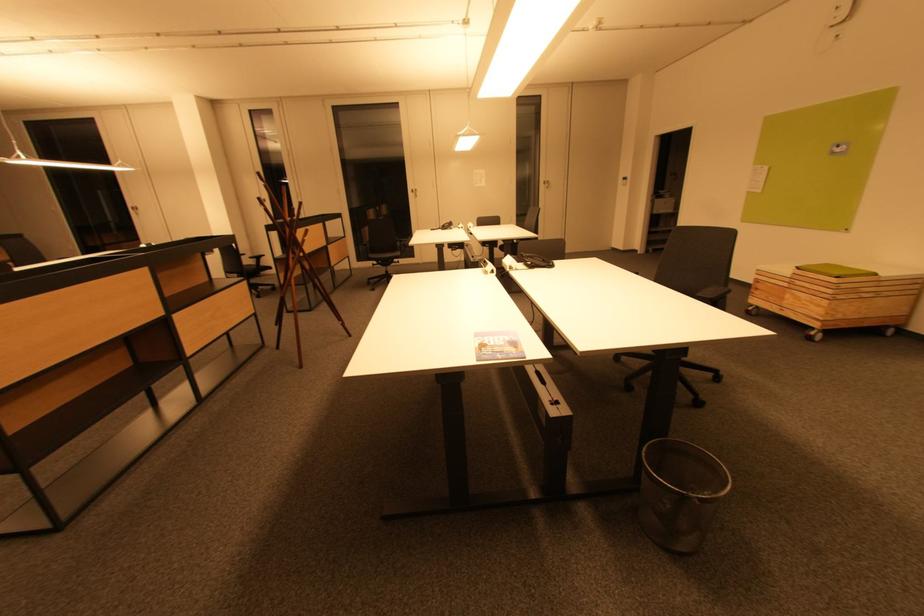
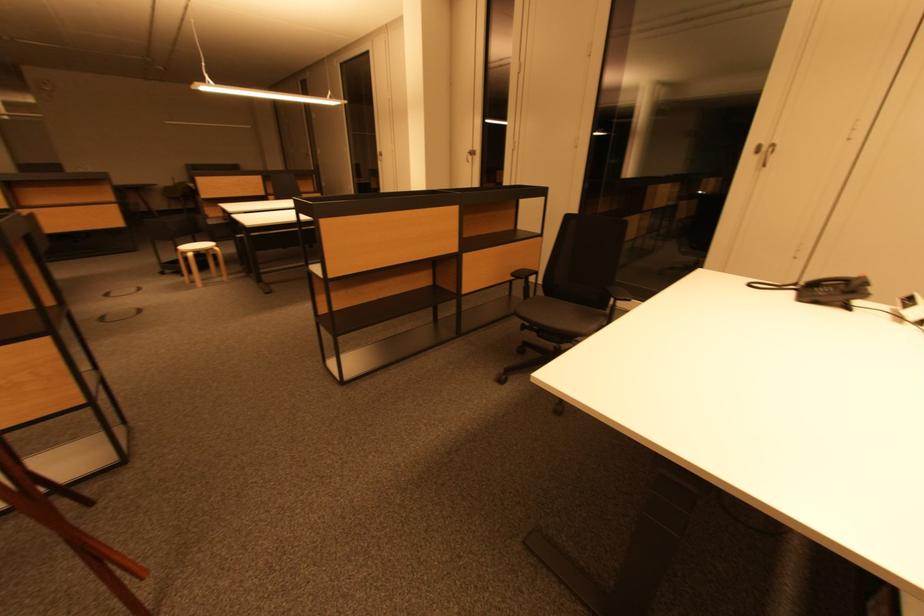
Where in the second image is the point corresponding to [465,229] from the first image?

(918, 320)